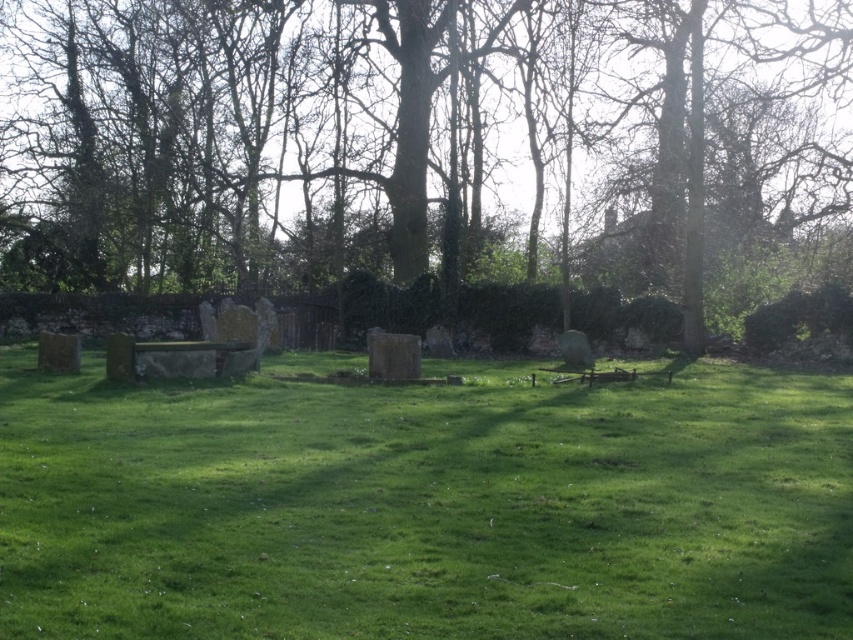
You are standing at the entrance of the cemetery and want to plant a new tree exactly where the green leafy tree at center is currently located. According to the coordinates provided, where should you place the new tree?

The green leafy tree at center should be planted at coordinates point (416, 141).

You are a gardener planning to mow the green grassy field at center. There is a green leafy tree at center nearby. Will the tree obstruct the mowing path if you proceed straight ahead from the edge of the field towards the tree?

The green leafy tree at center might be wider than the green grassy field at center, so there is a possibility that the tree could obstruct the mowing path if you proceed straight ahead from the edge of the field towards the tree.